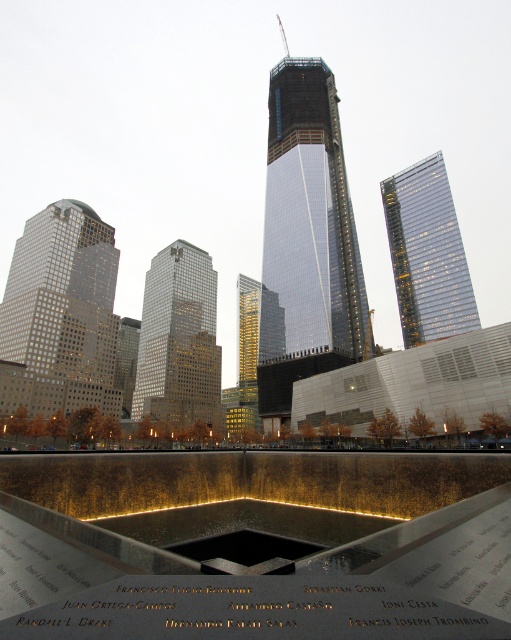
Question: Which of the following is the closest to the observer?

Choices:
 (A) reflective metallic water at center
 (B) gold reflective glass skyscraper at center
 (C) glassy reflective skyscraper at center-right
 (D) gold reflective glass building at center

Answer: (A)

Question: Based on their relative distances, which object is farther from the matte glass skyscraper at left?

Choices:
 (A) glassy steel skyscraper at center
 (B) gold reflective glass building at center
 (C) gold reflective glass skyscraper at center
 (D) reflective metallic water at center

Answer: (D)

Question: Is reflective metallic water at center behind matte glass skyscraper at left?

Choices:
 (A) no
 (B) yes

Answer: (A)

Question: Does matte glass skyscraper at left appear on the right side of glassy reflective skyscraper at center-right?

Choices:
 (A) no
 (B) yes

Answer: (A)

Question: Is gold reflective glass skyscraper at center closer to camera compared to gold reflective glass building at center?

Choices:
 (A) no
 (B) yes

Answer: (B)

Question: Based on their relative distances, which object is farther from the gold reflective glass building at center?

Choices:
 (A) matte glass skyscraper at left
 (B) gold reflective glass skyscraper at center
 (C) glassy reflective skyscraper at center-right
 (D) glassy steel skyscraper at center

Answer: (C)